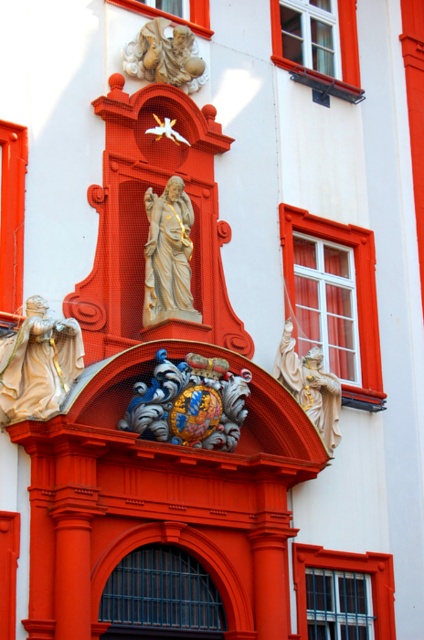
Question: Among these points, which one is nearest to the camera?

Choices:
 (A) (194, 381)
 (B) (323, 392)
 (C) (181, 250)

Answer: (A)

Question: Which point appears farthest from the camera in this image?

Choices:
 (A) (28, 356)
 (B) (159, 196)
 (C) (198, 60)

Answer: (C)

Question: Can you confirm if beige stone statue at upper left is wider than carved stone cherub at upper center?

Choices:
 (A) no
 (B) yes

Answer: (A)

Question: Can you confirm if beige stone statue at upper left is positioned to the left of carved stone cherub at upper center?

Choices:
 (A) no
 (B) yes

Answer: (B)

Question: Which object is the closest to the gold textured coat of arms at center?

Choices:
 (A) matte gold statue at center
 (B) carved stone cherub at upper center
 (C) gold/gilded stone angel at center

Answer: (A)

Question: Can you confirm if beige stone statue at upper left is positioned above matte gold statue at center?

Choices:
 (A) yes
 (B) no

Answer: (B)